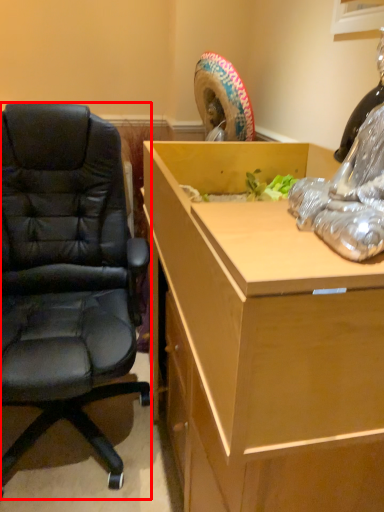
Question: Considering the relative positions of chair (annotated by the red box) and desk in the image provided, where is chair (annotated by the red box) located with respect to the staircase?

Choices:
 (A) right
 (B) left

Answer: (B)